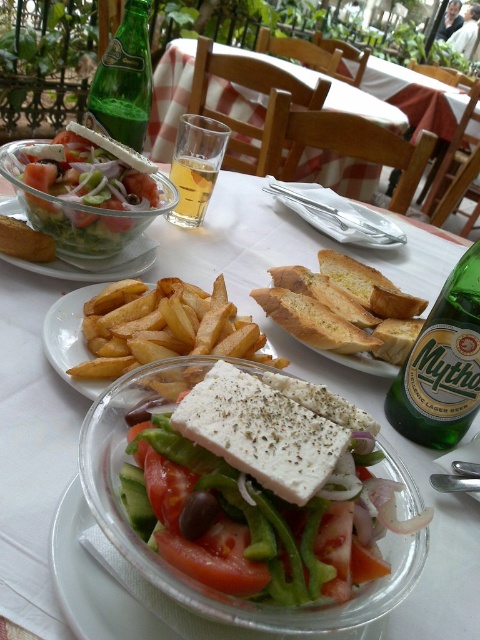
You are a customer at the outdoor dining area and want to reach both the golden crispy fries at center and the red matte tomato at center. Which item is placed on top of the other?

The golden crispy fries at center is positioned over the red matte tomato at center, so the fries are on top of the tomato.

You are a customer at the outdoor dining area and want to grab the green glass bottle at upper right to pour into the translucent glass at upper center. Which one should you pick up first?

You should pick up the translucent glass at upper center first because the green glass bottle at upper right is closer to you, so reaching for the farther translucent glass at upper center first would prevent knocking over the closer green glass bottle at upper right.

You are a customer at a restaurant and want to grab the green glass bottle at upper right to pour into your drink. However, you need to reach over the golden crispy fries at center. Considering their heights, which item will you have to bend down more to reach?

The green glass bottle at upper right is much taller than the golden crispy fries at center, so you would need to bend down less to reach it. However, since the bottle is taller, you might need to lean forward slightly to reach over the fries.